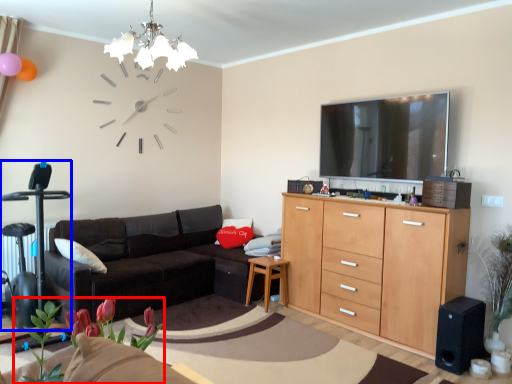
Question: Which object is further to the camera taking this photo, plant (highlighted by a red box) or swivel chair (highlighted by a blue box)?

Choices:
 (A) plant
 (B) swivel chair

Answer: (B)